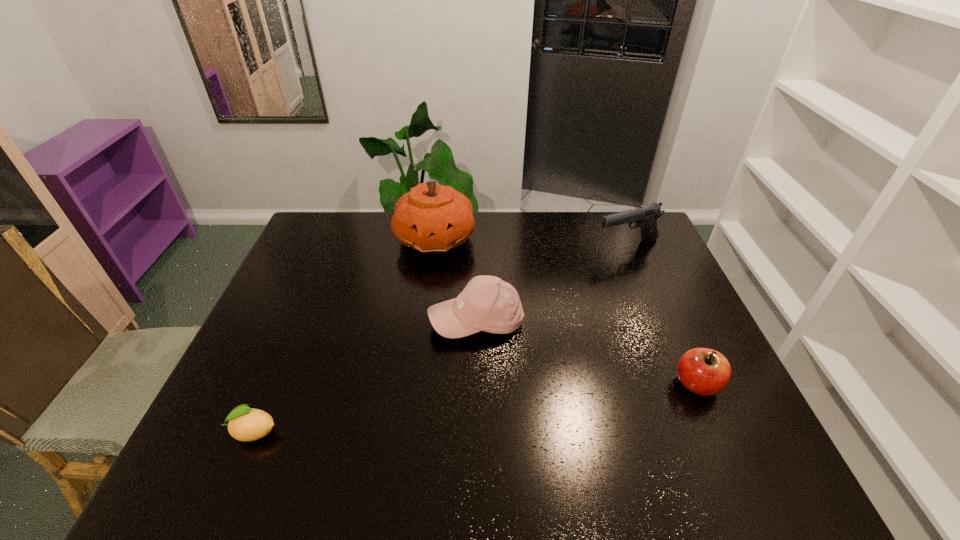
Identify the location of lemon located at the near edge. This screenshot has width=960, height=540. (245, 424).

This screenshot has width=960, height=540. Find the location of `apple present at the near edge`. apple present at the near edge is located at coordinates (703, 371).

Identify the location of object that is at the left edge. Image resolution: width=960 pixels, height=540 pixels. (245, 424).

Locate an element on the screen. The image size is (960, 540). apple situated at the right edge is located at coordinates (703, 371).

Locate an element on the screen. This screenshot has width=960, height=540. gun at the right edge is located at coordinates (645, 217).

The width and height of the screenshot is (960, 540). What are the coordinates of `object that is at the near left corner` in the screenshot? It's located at (245, 424).

The width and height of the screenshot is (960, 540). Identify the location of object that is at the far right corner. (645, 217).

Find the location of a particular element. This screenshot has height=540, width=960. object present at the near right corner is located at coordinates click(703, 371).

I want to click on blank space at the far edge of the desktop, so click(373, 238).

This screenshot has height=540, width=960. I want to click on vacant space at the near edge of the desktop, so click(639, 431).